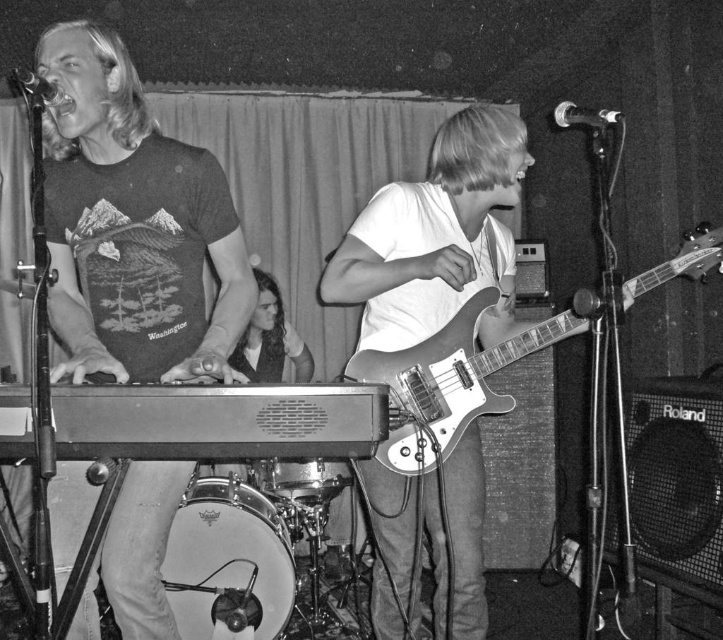
Does matte black keyboard at left have a lesser height compared to metallic drum at center?

No.

Is matte black keyboard at left positioned behind metallic drum at center?

No, it is in front of metallic drum at center.

Is point (194, 170) positioned behind point (316, 496)?

No, it is not.

I want to click on matte black keyboard at left, so click(132, 227).

From the picture: Does metallic silver guitar at center appear under dark brown leather jacket at center?

No, metallic silver guitar at center is not below dark brown leather jacket at center.

Who is positioned more to the left, metallic silver guitar at center or dark brown leather jacket at center?

From the viewer's perspective, dark brown leather jacket at center appears more on the left side.

Where is `metallic silver guitar at center`? The height and width of the screenshot is (640, 723). metallic silver guitar at center is located at coordinates (453, 378).

Is dark brown leather jacket at center further to camera compared to metallic drum at center?

Yes, it is behind metallic drum at center.

Is point (260, 342) positioned before point (294, 492)?

That is False.

What are the coordinates of `dark brown leather jacket at center` in the screenshot? It's located at (269, 339).